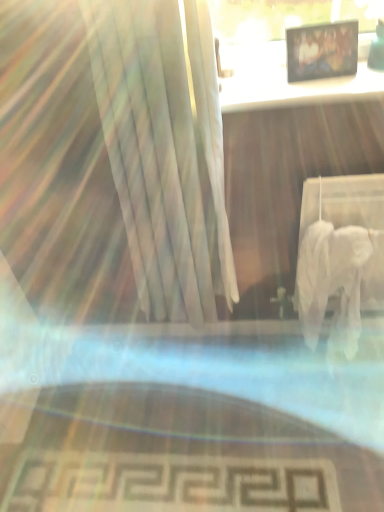
Question: Is wooden table at upper center inside the boundaries of wooden photo frame at upper center, or outside?

Choices:
 (A) inside
 (B) outside

Answer: (B)

Question: Is wooden table at upper center taller or shorter than wooden photo frame at upper center?

Choices:
 (A) short
 (B) tall

Answer: (A)

Question: In the image, is wooden table at upper center positioned in front of or behind wooden photo frame at upper center?

Choices:
 (A) behind
 (B) front

Answer: (B)

Question: Is wooden photo frame at upper center inside or outside of wooden table at upper center?

Choices:
 (A) outside
 (B) inside

Answer: (A)

Question: From a real-world perspective, is wooden photo frame at upper center above or below wooden table at upper center?

Choices:
 (A) below
 (B) above

Answer: (B)

Question: In the image, is wooden photo frame at upper center on the left side or the right side of wooden table at upper center?

Choices:
 (A) left
 (B) right

Answer: (B)

Question: In terms of width, does wooden photo frame at upper center look wider or thinner when compared to wooden table at upper center?

Choices:
 (A) thin
 (B) wide

Answer: (A)